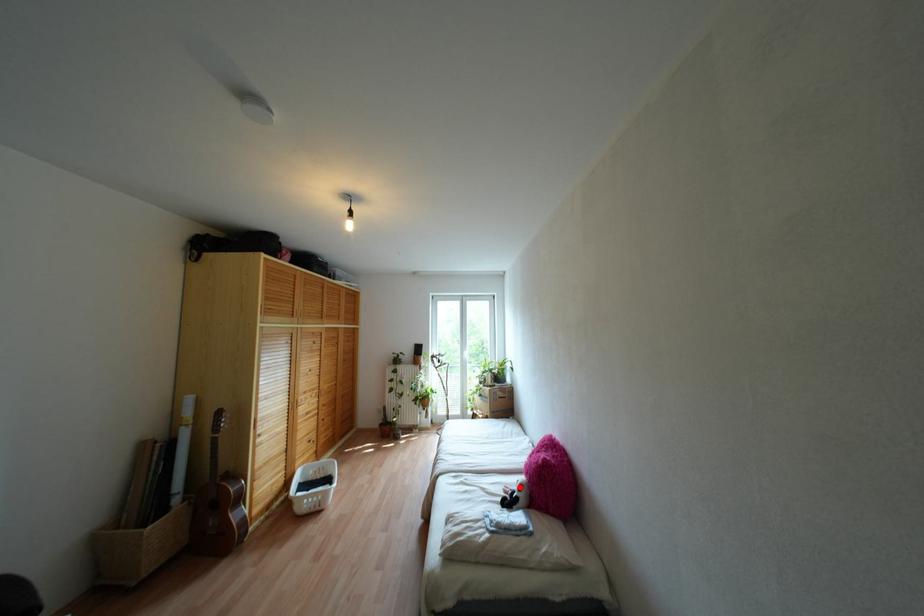
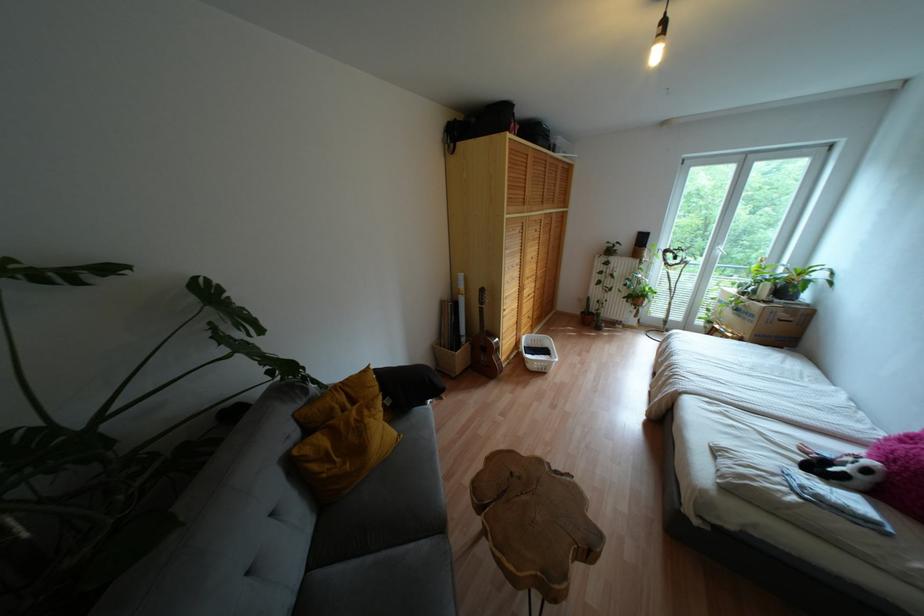
The point at the highlighted location is marked in the first image. Where is the corresponding point in the second image?

(867, 471)